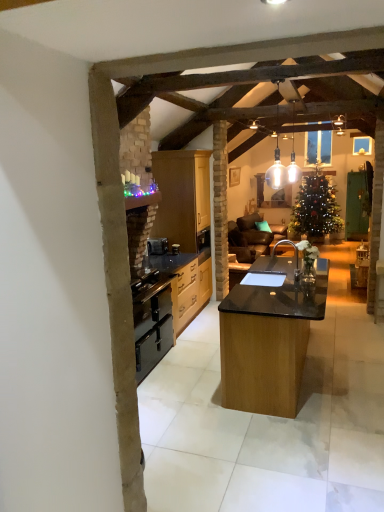
What do you see at coordinates (293, 157) in the screenshot?
I see `translucent glass pendant lights at upper center` at bounding box center [293, 157].

This screenshot has height=512, width=384. What are the coordinates of `black matte sink at center` in the screenshot? It's located at (263, 279).

This screenshot has height=512, width=384. What do you see at coordinates (269, 335) in the screenshot? I see `black granite table at center` at bounding box center [269, 335].

In the scene shown: What is the approximate height of black matte oven at center?

black matte oven at center is 6.53 inches in height.

The image size is (384, 512). In order to click on black matte oven at center in this screenshot , I will do `click(157, 246)`.

Describe the element at coordinates (157, 246) in the screenshot. I see `black matte oven at center` at that location.

What is the approximate width of matte wood cabinets at center, which appears as the 2th cabinetry when ordered from the bottom?

matte wood cabinets at center, which appears as the 2th cabinetry when ordered from the bottom, is 29.59 inches wide.

What do you see at coordinates (187, 283) in the screenshot?
I see `black wood cabinets at center, arranged as the first cabinetry when ordered from the bottom` at bounding box center [187, 283].

You are a GUI agent. You are given a task and a screenshot of the screen. Output one action in this format:
    pyautogui.click(x=<x>, y=<y>)
    Task: Click on the translucent glass pendant lights at upper center
    This screenshot has width=384, height=512.
    Given the screenshot: What is the action you would take?
    pyautogui.click(x=293, y=157)

Looking at this image, is black matte oven at center with black wood cabinets at center, arranged as the first cabinetry when ordered from the bottom?

black matte oven at center is not next to black wood cabinets at center, arranged as the first cabinetry when ordered from the bottom, and they're not touching.

From a real-world perspective, is black matte oven at center located higher than black wood cabinets at center, arranged as the first cabinetry when ordered from the bottom?

Yes, from a real-world perspective, black matte oven at center is over black wood cabinets at center, arranged as the first cabinetry when ordered from the bottom

Can you confirm if black matte oven at center is smaller than black wood cabinets at center, arranged as the first cabinetry when ordered from the bottom?

Indeed, black matte oven at center has a smaller size compared to black wood cabinets at center, arranged as the first cabinetry when ordered from the bottom.

Considering the positions of points (173, 254) and (191, 278), is point (173, 254) farther from camera compared to point (191, 278)?

That is True.

Is black matte oven at center turned away from black granite table at center?

No, black matte oven at center's orientation is not away from black granite table at center.

Would you say black matte oven at center is outside black granite table at center?

Yes.

Considering the sizes of objects black matte oven at center and black granite table at center in the image provided, who is bigger, black matte oven at center or black granite table at center?

black granite table at center is bigger.

Could you measure the distance between translucent glass pendant lights at upper center and black wood cabinets at center, the 2th cabinetry in the top-to-bottom sequence?

translucent glass pendant lights at upper center and black wood cabinets at center, the 2th cabinetry in the top-to-bottom sequence, are 1.75 meters apart from each other.

In the scene shown: Is translucent glass pendant lights at upper center not inside black wood cabinets at center, the 2th cabinetry in the top-to-bottom sequence?

Yes, translucent glass pendant lights at upper center is not within black wood cabinets at center, the 2th cabinetry in the top-to-bottom sequence.

Does point (294, 165) come farther from viewer compared to point (175, 322)?

That is True.

Is black matte sink at center far from translucent glass pendant lights at upper center?

Indeed, black matte sink at center is not near translucent glass pendant lights at upper center.

Does black matte sink at center have a larger size compared to translucent glass pendant lights at upper center?

Correct, black matte sink at center is larger in size than translucent glass pendant lights at upper center.

Can you confirm if black matte sink at center is shorter than translucent glass pendant lights at upper center?

Indeed, black matte sink at center has a lesser height compared to translucent glass pendant lights at upper center.

Is black matte sink at center situated inside translucent glass pendant lights at upper center or outside?

The correct answer is: outside.

From a real-world perspective, which is physically above, black matte oven at center or black wood cabinets at center, arranged as the first cabinetry when ordered from the bottom?

From a 3D spatial view, black matte oven at center is above.

Is black matte oven at center closer to camera compared to black wood cabinets at center, arranged as the first cabinetry when ordered from the bottom?

No, black matte oven at center is further to the viewer.

Can you confirm if black matte oven at center is smaller than black wood cabinets at center, arranged as the first cabinetry when ordered from the bottom?

Yes.

From their relative heights in the image, would you say black matte sink at center is taller or shorter than black wood cabinets at center, arranged as the first cabinetry when ordered from the bottom?

black matte sink at center is shorter than black wood cabinets at center, arranged as the first cabinetry when ordered from the bottom.

From a real-world perspective, is black matte sink at center over black wood cabinets at center, the 2th cabinetry in the top-to-bottom sequence?

Yes, from a real-world perspective, black matte sink at center is over black wood cabinets at center, the 2th cabinetry in the top-to-bottom sequence

Between black matte sink at center and black wood cabinets at center, the 2th cabinetry in the top-to-bottom sequence, which one appears on the left side from the viewer's perspective?

From the viewer's perspective, black wood cabinets at center, the 2th cabinetry in the top-to-bottom sequence, appears more on the left side.

Would you say black wood cabinets at center, arranged as the first cabinetry when ordered from the bottom, is part of black matte sink at center's contents?

No, black matte sink at center does not contain black wood cabinets at center, arranged as the first cabinetry when ordered from the bottom.

Does black matte oven at center have a lesser width compared to black matte sink at center?

Correct, the width of black matte oven at center is less than that of black matte sink at center.

Considering the points (153, 240) and (272, 278), which point is in front, point (153, 240) or point (272, 278)?

Positioned in front is point (272, 278).

Where is `appliance positioned vertically above the black wood cabinets at center, the 2th cabinetry in the top-to-bottom sequence (from a real-world perspective)`? This screenshot has width=384, height=512. appliance positioned vertically above the black wood cabinets at center, the 2th cabinetry in the top-to-bottom sequence (from a real-world perspective) is located at coordinates (175, 249).

Where is `table located below the black matte oven at center (from the image's perspective)`? This screenshot has width=384, height=512. table located below the black matte oven at center (from the image's perspective) is located at coordinates [269, 335].

Estimate the real-world distances between objects in this image. Which object is further from black wood cabinets at center, arranged as the first cabinetry when ordered from the bottom, black granite table at center or black matte sink at center?

black granite table at center is positioned further to the anchor black wood cabinets at center, arranged as the first cabinetry when ordered from the bottom.

Which object lies nearer to the anchor point black wood cabinets at center, arranged as the first cabinetry when ordered from the bottom, brown leather couch at center or black matte oven at center?

black matte oven at center is closer to black wood cabinets at center, arranged as the first cabinetry when ordered from the bottom.

When comparing their distances from black granite table at center, does black matte oven at center or black matte sink at center seem further?

black matte oven at center is further to black granite table at center.

When comparing their distances from brown leather couch at center, does translucent glass pendant lights at upper center or black matte oven at center seem further?

black matte oven at center lies further to brown leather couch at center than the other object.

When comparing their distances from brown leather couch at center, does black matte oven at center or black granite table at center seem closer?

black matte oven at center lies closer to brown leather couch at center than the other object.

Which object lies nearer to the anchor point black wood cabinets at center, the 2th cabinetry in the top-to-bottom sequence, matte wood cabinets at center, which appears as the 2th cabinetry when ordered from the bottom, or black matte oven at center?

Based on the image, black matte oven at center appears to be nearer to black wood cabinets at center, the 2th cabinetry in the top-to-bottom sequence.

When comparing their distances from matte wood cabinets at center, which appears as the 2th cabinetry when ordered from the bottom, does brown leather couch at center or black matte oven at center seem closer?

black matte oven at center is closer to matte wood cabinets at center, which appears as the 2th cabinetry when ordered from the bottom.

In the scene shown: Based on their spatial positions, is brown leather couch at center or matte wood cabinets at center, which appears as the 2th cabinetry when ordered from the bottom, further from black matte oven at center?

brown leather couch at center is further to black matte oven at center.

I want to click on appliance between black granite table at center and brown leather couch at center along the z-axis, so click(175, 249).

Image resolution: width=384 pixels, height=512 pixels. Find the location of `sink positioned between black granite table at center and black wood cabinets at center, arranged as the first cabinetry when ordered from the bottom, from near to far`. sink positioned between black granite table at center and black wood cabinets at center, arranged as the first cabinetry when ordered from the bottom, from near to far is located at coordinates (263, 279).

This screenshot has height=512, width=384. Find the location of `kitchen appliance between black matte oven at center and brown leather couch at center from front to back`. kitchen appliance between black matte oven at center and brown leather couch at center from front to back is located at coordinates (157, 246).

At what (x,y) coordinates should I click in order to perform the action: click on appliance between black wood cabinets at center, the 2th cabinetry in the top-to-bottom sequence, and black matte oven at center, along the z-axis. Please return your answer as a coordinate pair (x, y). Looking at the image, I should click on (175, 249).